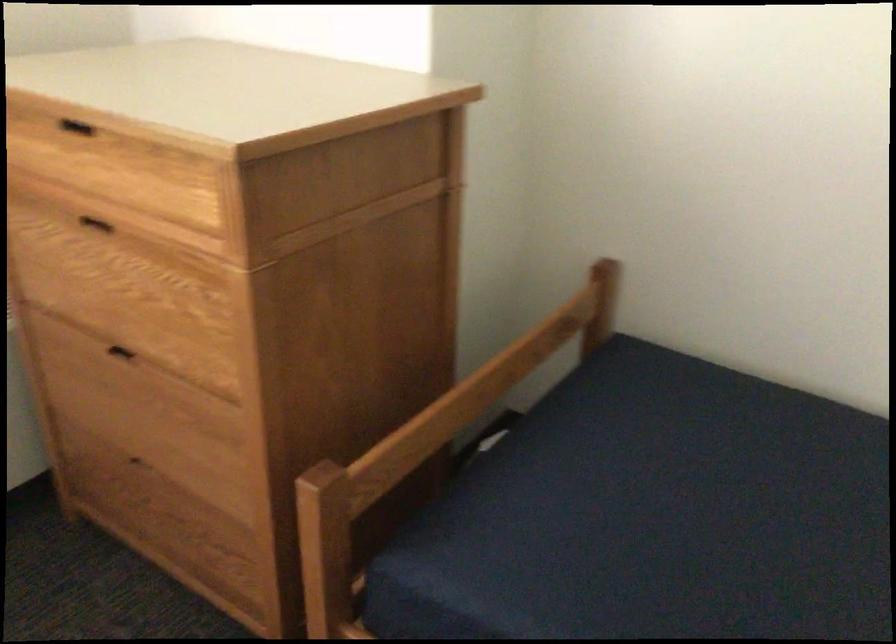
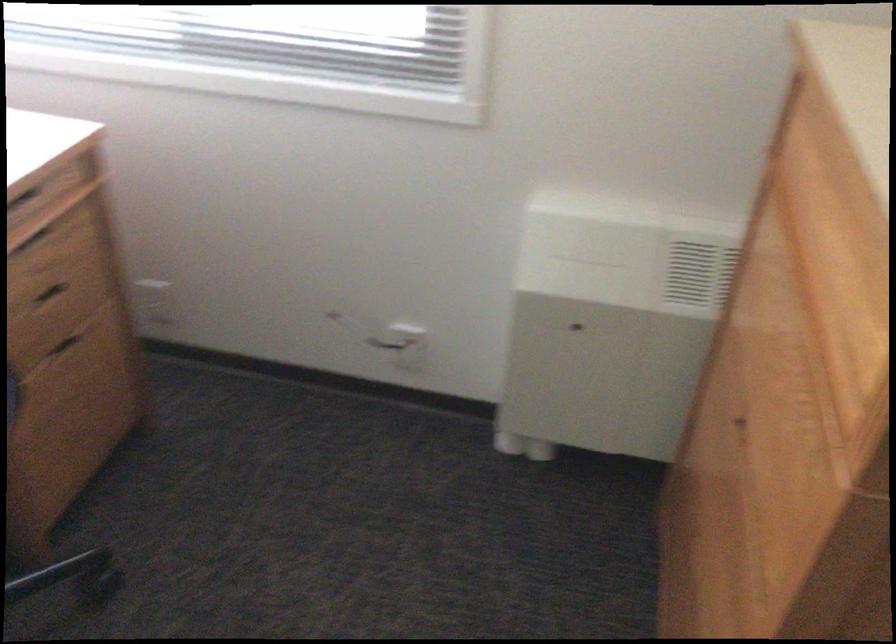
Based on the continuous images, in which direction is the camera rotating?

The camera rotated toward left-down.